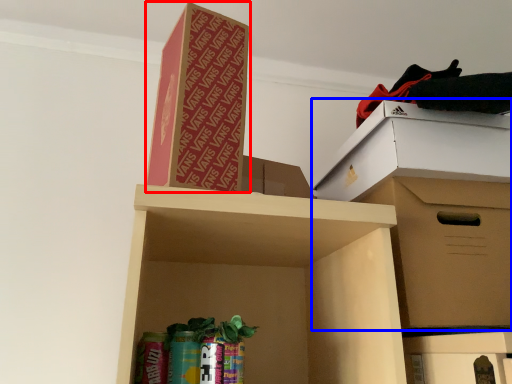
Question: Which point is closer to the camera, cardboard box (highlighted by a red box) or cardboard box (highlighted by a blue box)?

Choices:
 (A) cardboard box
 (B) cardboard box

Answer: (A)